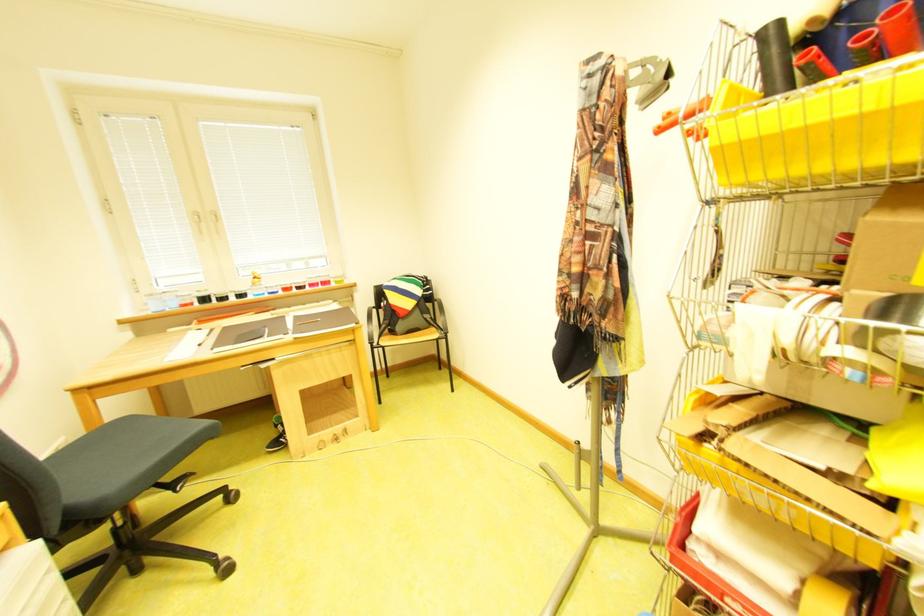
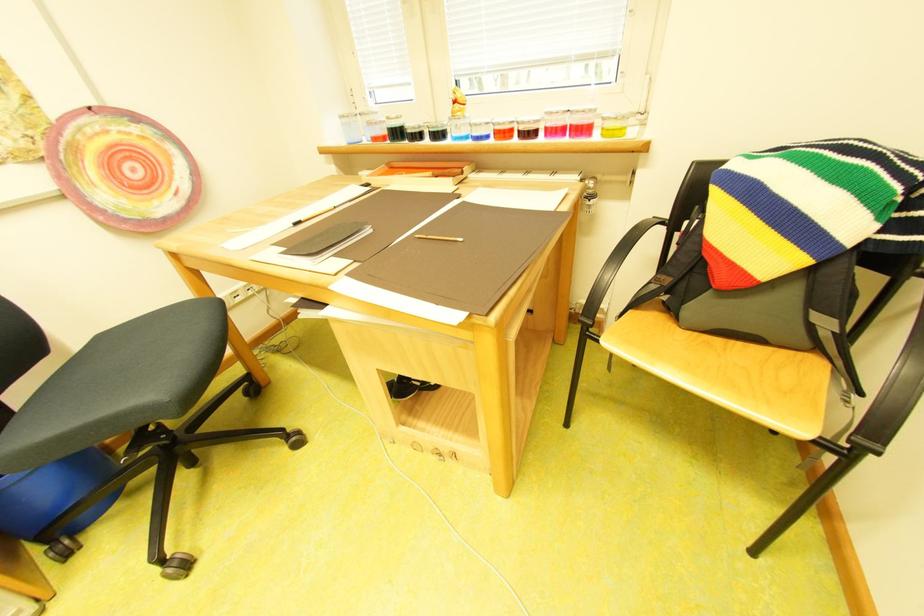
Find the pixel in the second image that matches (x=394, y=305) in the first image.

(698, 224)